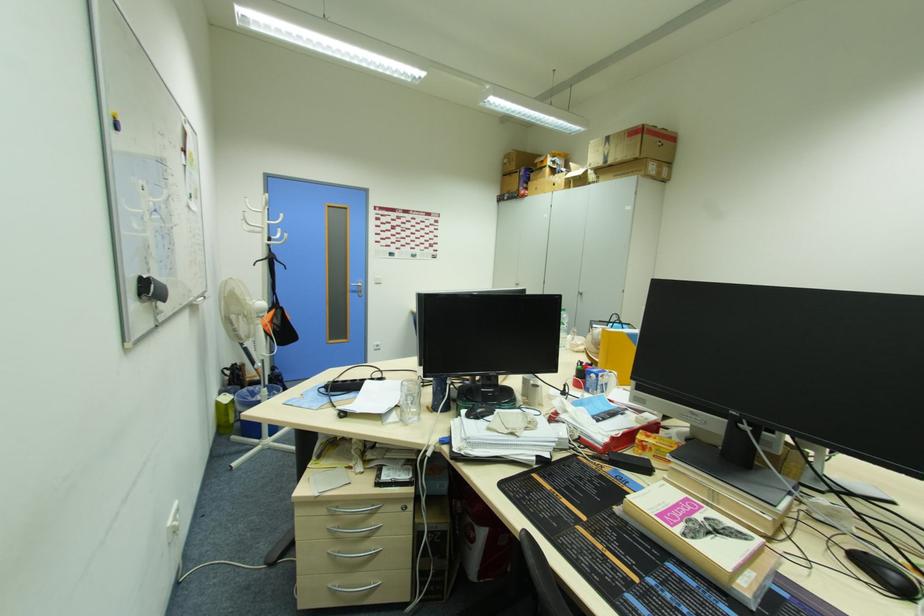
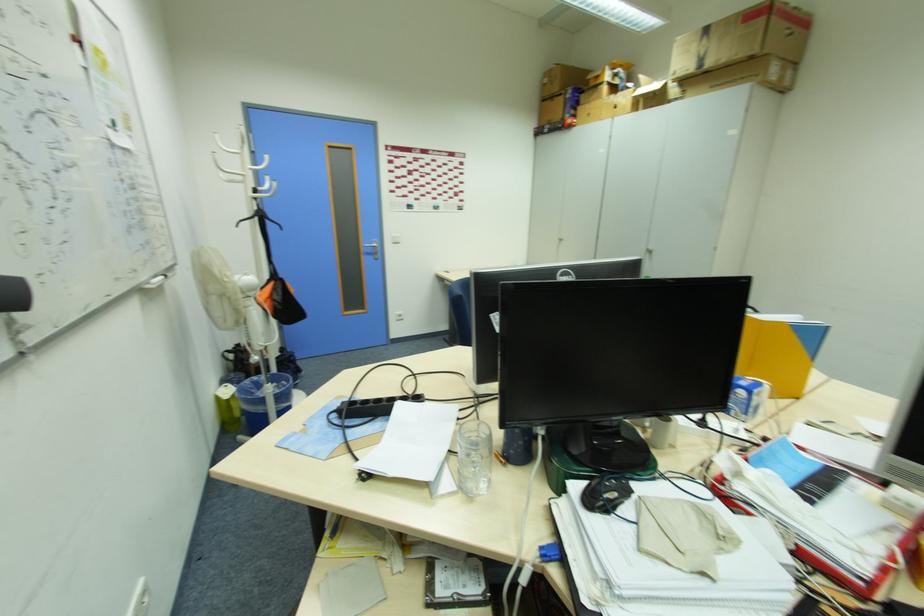
Question: Which direction would the cameraman need to move to produce the second image? Reply with the corresponding letter.

Choices:
 (A) Left
 (B) Right
 (C) Forward
 (D) Backward

Answer: (C)